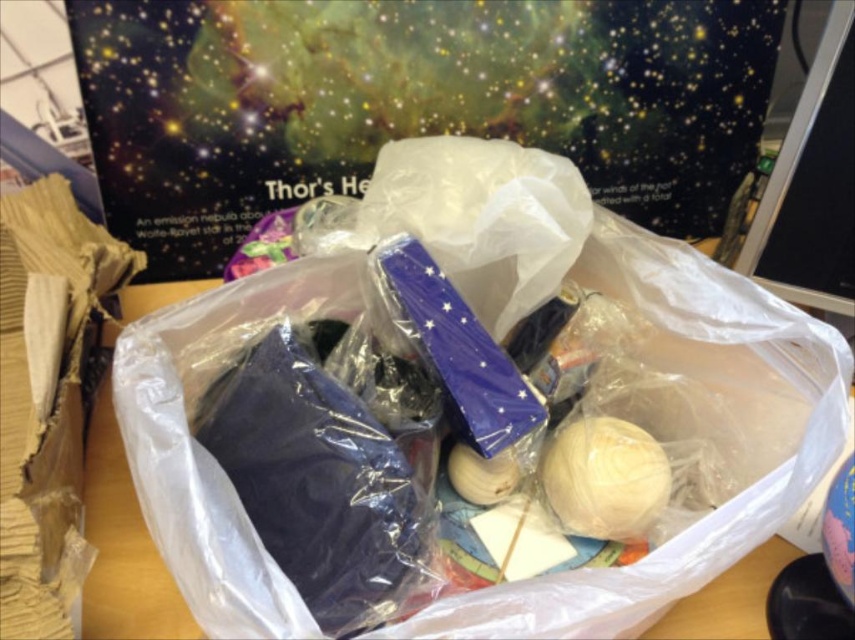
Question: Which of the following is the farthest from the observer?

Choices:
 (A) (635, 529)
 (B) (733, 320)

Answer: (B)

Question: Which of the following is the closest to the observer?

Choices:
 (A) (624, 516)
 (B) (466, 188)

Answer: (A)

Question: Can you confirm if translucent plastic bag at center is positioned above smooth beige yarn at lower right?

Choices:
 (A) yes
 (B) no

Answer: (A)

Question: Can you confirm if translucent plastic bag at center is positioned above smooth beige yarn at lower right?

Choices:
 (A) no
 (B) yes

Answer: (B)

Question: Can you confirm if translucent plastic bag at center is positioned above smooth beige yarn at lower right?

Choices:
 (A) yes
 (B) no

Answer: (A)